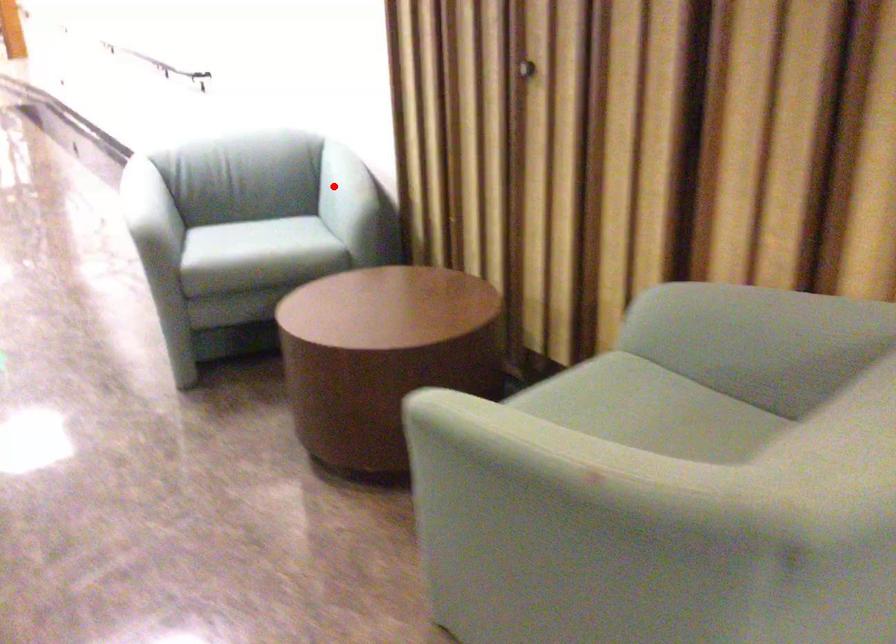
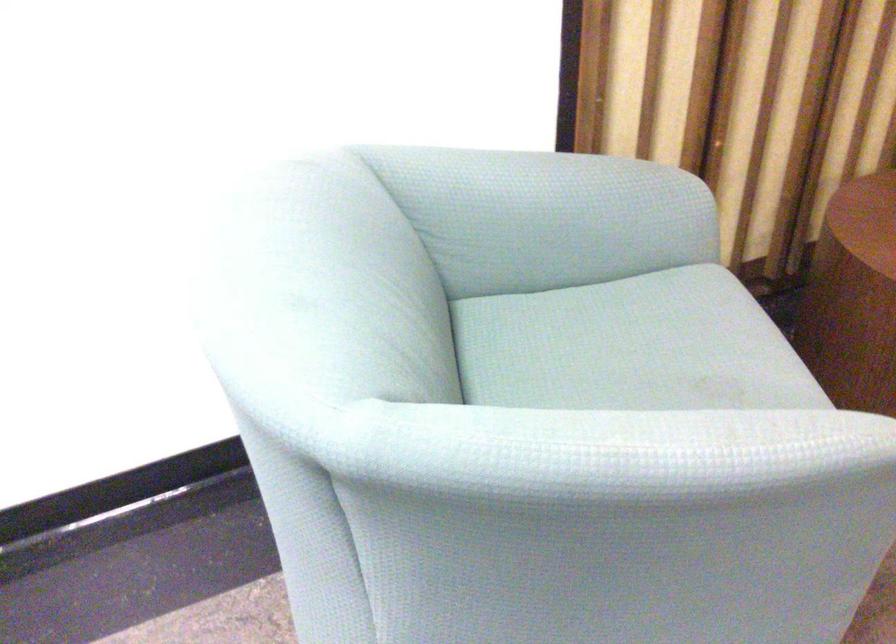
Locate, in the second image, the point that corresponds to the highlighted location in the first image.

(545, 216)